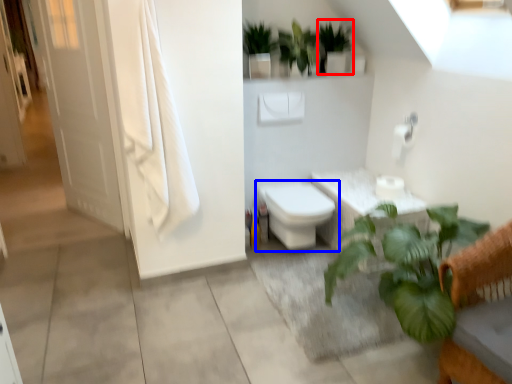
Question: Among these objects, which one is farthest to the camera, vegetation (highlighted by a red box) or toilet (highlighted by a blue box)?

Choices:
 (A) vegetation
 (B) toilet

Answer: (A)